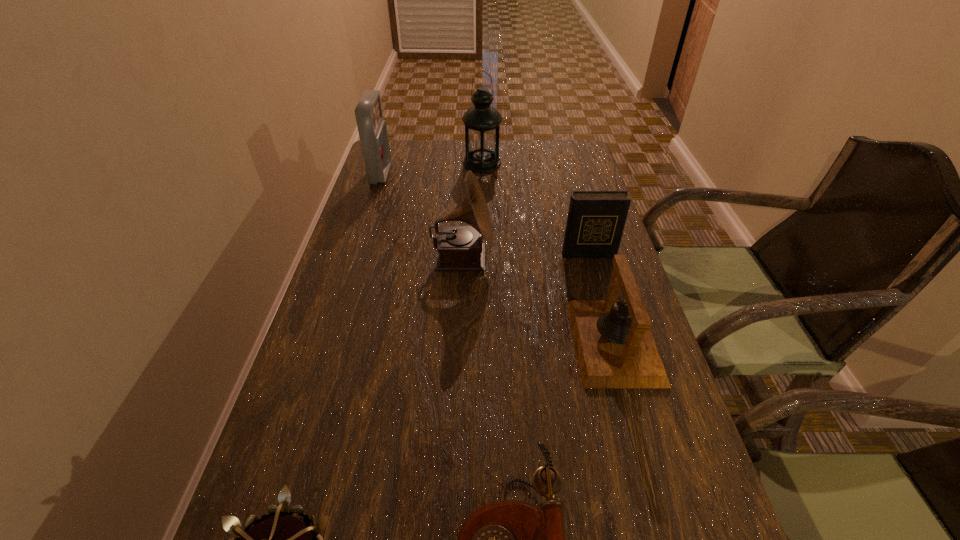
Locate an element on the screen. The width and height of the screenshot is (960, 540). oil lamp is located at coordinates pyautogui.click(x=481, y=121).

Identify the location of the first-aid kit. The height and width of the screenshot is (540, 960). (372, 129).

In order to click on phonograph record in this screenshot , I will do `click(460, 248)`.

Locate an element on the screen. diary is located at coordinates pyautogui.click(x=596, y=219).

Find the location of a particular element. Image resolution: width=960 pixels, height=540 pixels. bell is located at coordinates (615, 348).

Identify the location of vacant space situated 0.140m on the right of the oil lamp. This screenshot has height=540, width=960. (542, 164).

Find the location of a particular element. The height and width of the screenshot is (540, 960). vacant space located 0.240m on the front-facing side of the first-aid kit is located at coordinates (462, 174).

This screenshot has height=540, width=960. Identify the location of vacant region located 0.130m on the horn of the phonograph record. (543, 260).

This screenshot has height=540, width=960. I want to click on blank space located on the front cover of the diary, so click(602, 303).

Where is `vacant position located 0.260m on the left of the third nearest object`? vacant position located 0.260m on the left of the third nearest object is located at coordinates (452, 342).